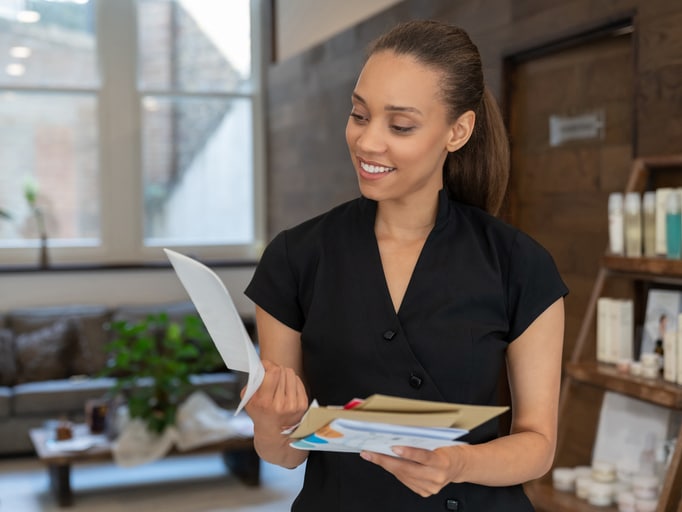
Locate an element on the screen. Image resolution: width=682 pixels, height=512 pixels. sofa is located at coordinates (65, 345).